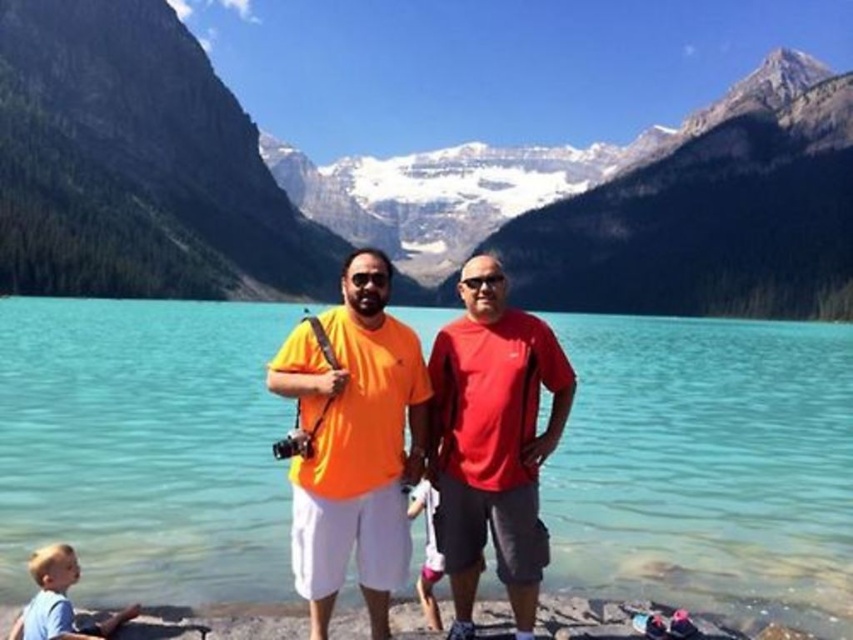
Question: Which object appears farthest from the camera in this image?

Choices:
 (A) blue cotton shirt at lower left
 (B) snowy granite mountain at upper center

Answer: (B)

Question: Which point is farther to the camera?

Choices:
 (A) white cotton shirt at center
 (B) orange cotton t-shirt at center
 (C) clear blue water at center

Answer: (C)

Question: From the image, what is the correct spatial relationship of snowy granite mountain at upper center in relation to white cotton shirt at center?

Choices:
 (A) left
 (B) right

Answer: (B)

Question: Observing the image, what is the correct spatial positioning of blue cotton shirt at lower left in reference to white cotton shirt at center?

Choices:
 (A) above
 (B) below

Answer: (B)

Question: Is snowy granite mountain at upper center bigger than white cotton shirt at center?

Choices:
 (A) yes
 (B) no

Answer: (A)

Question: Which point is closer to the camera taking this photo?

Choices:
 (A) (370, 444)
 (B) (437, 568)
 (C) (62, 232)

Answer: (A)